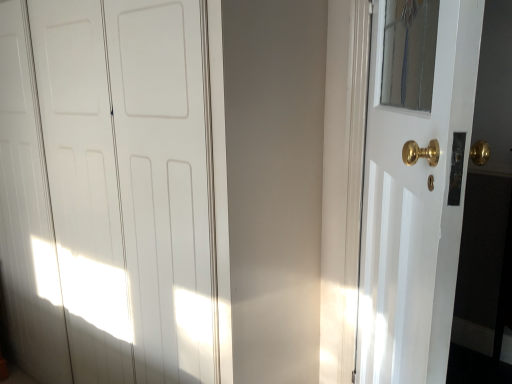
Question: Is white glossy door at right, which appears as the 1th door when viewed from the right, far away from white glossy door at center, which is the second door from right to left?

Choices:
 (A) no
 (B) yes

Answer: (A)

Question: Is white glossy door at right, which appears as the 1th door when viewed from the right, looking in the opposite direction of white glossy door at center, which appears as the 1th door when viewed from the left?

Choices:
 (A) yes
 (B) no

Answer: (A)

Question: Is white glossy door at right, which appears as the second door when viewed from the left, outside white glossy door at center, which is the second door from right to left?

Choices:
 (A) no
 (B) yes

Answer: (B)

Question: From the image's perspective, is white glossy door at right, which appears as the second door when viewed from the left, on top of white glossy door at center, which is the second door from right to left?

Choices:
 (A) yes
 (B) no

Answer: (B)

Question: Could white glossy door at center, which is the second door from right to left, be considered to be inside white glossy door at right, which appears as the 1th door when viewed from the right?

Choices:
 (A) no
 (B) yes

Answer: (A)

Question: Is white glossy door at right, which appears as the 1th door when viewed from the right, shorter than white glossy door at center, which appears as the 1th door when viewed from the left?

Choices:
 (A) no
 (B) yes

Answer: (B)

Question: Is white glossy door at center, which appears as the 1th door when viewed from the left, bigger than white glossy door at right, which appears as the 1th door when viewed from the right?

Choices:
 (A) yes
 (B) no

Answer: (A)

Question: Is white glossy door at center, which appears as the 1th door when viewed from the left, taller than white glossy door at right, which appears as the second door when viewed from the left?

Choices:
 (A) yes
 (B) no

Answer: (A)

Question: Could you tell me if white glossy door at center, which is the second door from right to left, is facing white glossy door at right, which appears as the 1th door when viewed from the right?

Choices:
 (A) yes
 (B) no

Answer: (B)

Question: Is white glossy door at center, which appears as the 1th door when viewed from the left, at the right side of white glossy door at right, which appears as the 1th door when viewed from the right?

Choices:
 (A) no
 (B) yes

Answer: (A)

Question: From a real-world perspective, is white glossy door at center, which appears as the 1th door when viewed from the left, positioned over white glossy door at right, which appears as the 1th door when viewed from the right, based on gravity?

Choices:
 (A) yes
 (B) no

Answer: (B)

Question: Considering the relative positions of white glossy door at center, which appears as the 1th door when viewed from the left, and white glossy door at right, which appears as the 1th door when viewed from the right, in the image provided, is white glossy door at center, which appears as the 1th door when viewed from the left, in front of white glossy door at right, which appears as the 1th door when viewed from the right,?

Choices:
 (A) no
 (B) yes

Answer: (A)

Question: In the image, is white glossy door at right, which appears as the 1th door when viewed from the right, positioned in front of or behind white glossy door at center, which appears as the 1th door when viewed from the left?

Choices:
 (A) behind
 (B) front

Answer: (B)